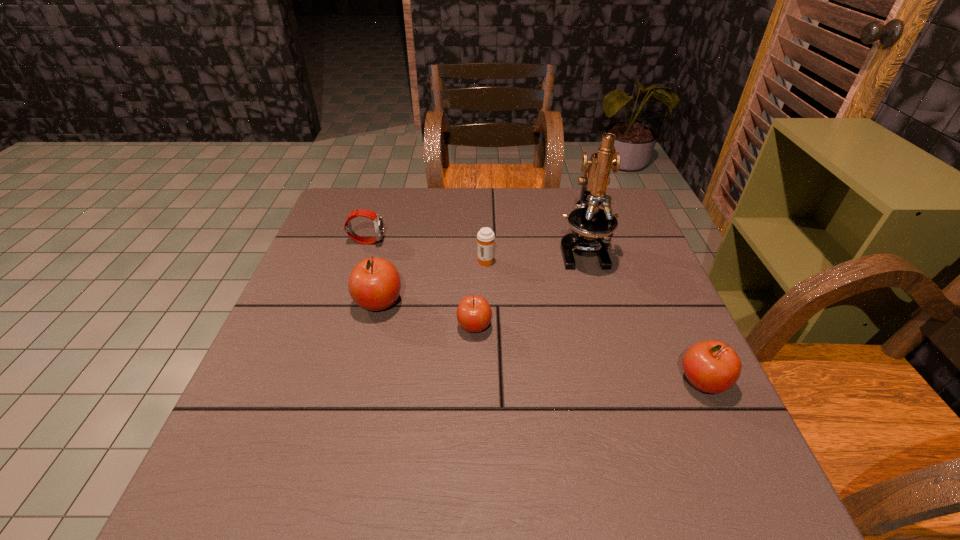
The width and height of the screenshot is (960, 540). What are the coordinates of `free location that satisfies the following two spatial constraints: 1. on the face of the watch; 2. on the right side of the medicine` in the screenshot? It's located at (361, 260).

Where is `free region that satisfies the following two spatial constraints: 1. on the back side of the medicine; 2. on the left side of the tallest apple`? The width and height of the screenshot is (960, 540). free region that satisfies the following two spatial constraints: 1. on the back side of the medicine; 2. on the left side of the tallest apple is located at coordinates (389, 260).

Find the location of a particular element. vacant space that satisfies the following two spatial constraints: 1. on the face of the watch; 2. on the left side of the medicine is located at coordinates (361, 260).

Identify the location of free spot that satisfies the following two spatial constraints: 1. on the face of the second apple from left to right; 2. on the right side of the watch. This screenshot has width=960, height=540. (339, 327).

The image size is (960, 540). Identify the location of free space that satisfies the following two spatial constraints: 1. at the eyepiece of the tallest object; 2. on the left side of the rightmost object. (620, 382).

The height and width of the screenshot is (540, 960). In order to click on vacant region that satisfies the following two spatial constraints: 1. on the front side of the leftmost apple; 2. on the right side of the shortest apple in this screenshot , I will do `click(372, 327)`.

The height and width of the screenshot is (540, 960). Find the location of `vacant space that satisfies the following two spatial constraints: 1. on the back side of the rightmost apple; 2. on the face of the watch`. vacant space that satisfies the following two spatial constraints: 1. on the back side of the rightmost apple; 2. on the face of the watch is located at coordinates (638, 241).